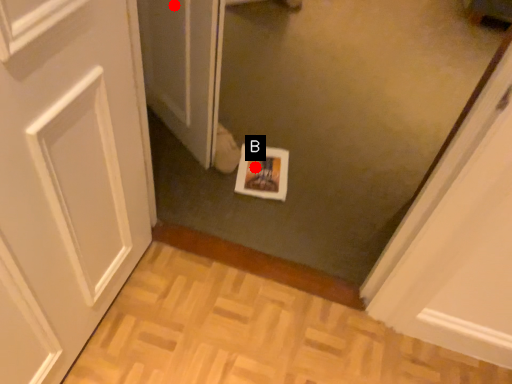
Question: Two points are circled on the image, labeled by A and B beside each circle. Which point is further to the camera?

Choices:
 (A) A is further
 (B) B is further

Answer: (B)